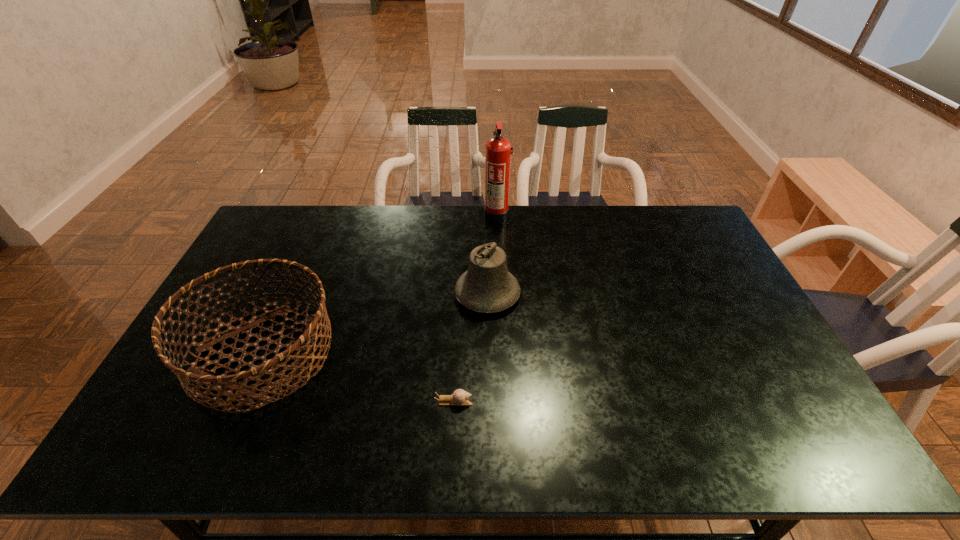
You are a GUI agent. You are given a task and a screenshot of the screen. Output one action in this format:
    pyautogui.click(x=<x>, y=<y>)
    Task: Click on the vacant space in between the basket and the bell
    This screenshot has width=960, height=540.
    Given the screenshot: What is the action you would take?
    pyautogui.click(x=374, y=324)

Find the location of a particular element. The width and height of the screenshot is (960, 540). free space between the farthest object and the leftmost object is located at coordinates (379, 284).

The image size is (960, 540). Identify the location of vacant area between the leftmost object and the bell. (374, 324).

The width and height of the screenshot is (960, 540). Find the location of `vacant space that's between the leftmost object and the fire extinguisher`. vacant space that's between the leftmost object and the fire extinguisher is located at coordinates (379, 284).

What are the coordinates of `object that is the third closest one to the leftmost object` in the screenshot? It's located at (498, 152).

This screenshot has width=960, height=540. What are the coordinates of `object that is the second closest to the shortest object` in the screenshot? It's located at (303, 344).

Locate an element on the screen. The width and height of the screenshot is (960, 540). free space that satisfies the following two spatial constraints: 1. on the back side of the bell; 2. on the right side of the basket is located at coordinates (288, 294).